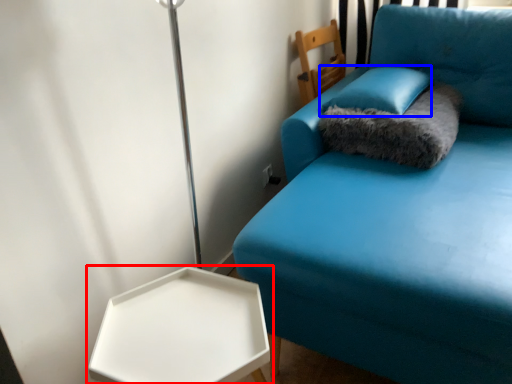
Question: Which object appears closest to the camera in this image, table (highlighted by a red box) or pillow (highlighted by a blue box)?

Choices:
 (A) table
 (B) pillow

Answer: (A)